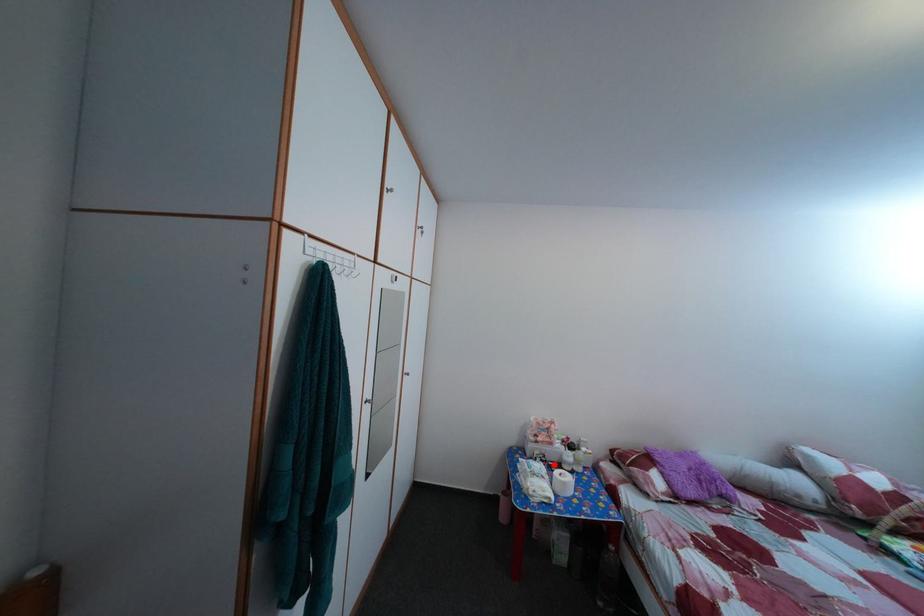
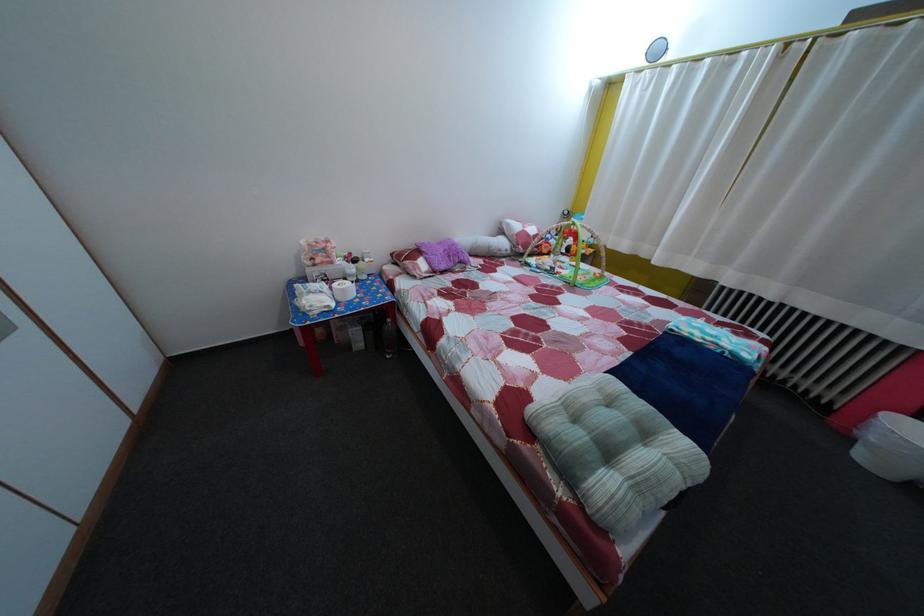
Question: I am providing you with two images of the same scene from different viewpoints. A red point is marked on the first image. Can you still see the location of the red point in image 2?

Choices:
 (A) Yes
 (B) No

Answer: (A)